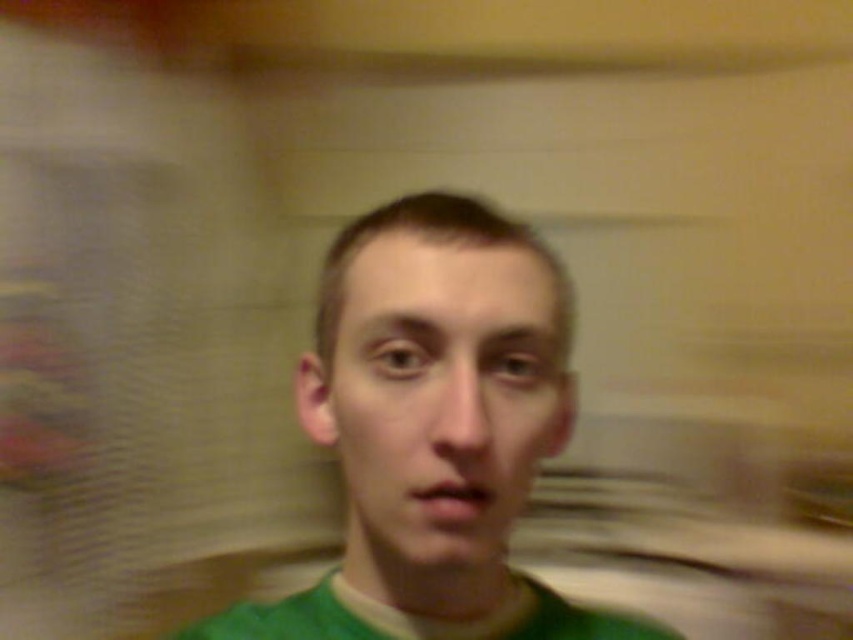
You are trying to edit a photo where the subject has a green matte shirt at center and a green matte face at center. Which object is positioned to the right in the image?

The green matte shirt at center is positioned to the right of the green matte face at center.

You are trying to locate the green matte shirt at center in a blurry image. The image has a point at coordinates (434, 429). Is the green matte shirt at center located at that point?

Yes, the green matte shirt at center is located at point (434, 429).

You are taking a selfie and want to ensure both the green matte shirt at center and the green matte face at center are visible clearly. Given the motion blur from the camera movement, which object should you focus on first to ensure it appears sharp in the final photo?

The green matte shirt at center is bigger than the green matte face at center, so focusing on the green matte shirt at center first would ensure it appears sharp in the final photo due to its larger size requiring more precise focus.